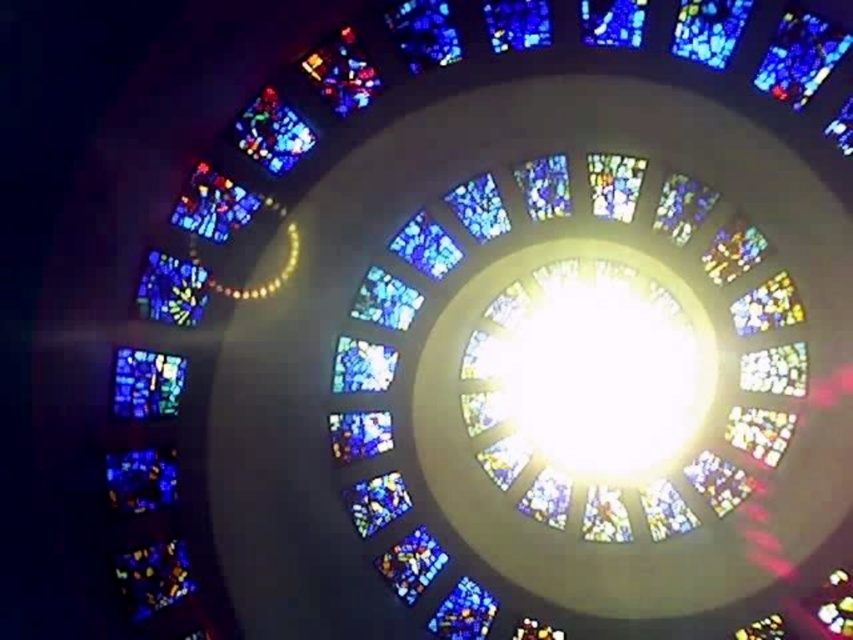
Who is positioned more to the left, multicolored stained glass at center or multicolored stained glass at lower left?

Positioned to the left is multicolored stained glass at lower left.

Is multicolored stained glass at center wider than multicolored stained glass at lower left?

Yes.

Is point (450, 321) more distant than point (135, 413)?

Yes, point (450, 321) is behind point (135, 413).

In order to click on multicolored stained glass at center in this screenshot , I will do `click(601, 401)`.

From the picture: Is transparent glass dome at center smaller than multicolored stained glass at lower left?

No, transparent glass dome at center is not smaller than multicolored stained glass at lower left.

Does transparent glass dome at center appear under multicolored stained glass at lower left?

Indeed, transparent glass dome at center is positioned under multicolored stained glass at lower left.

Where is `transparent glass dome at center`? This screenshot has height=640, width=853. transparent glass dome at center is located at coordinates (589, 371).

Where is `transparent glass dome at center`? This screenshot has width=853, height=640. transparent glass dome at center is located at coordinates (589, 371).

Is multicolored stained glass at center thinner than transparent glass dome at center?

No.

Is multicolored stained glass at center positioned in front of transparent glass dome at center?

That is True.

Find the location of a particular element. multicolored stained glass at center is located at coordinates (601, 401).